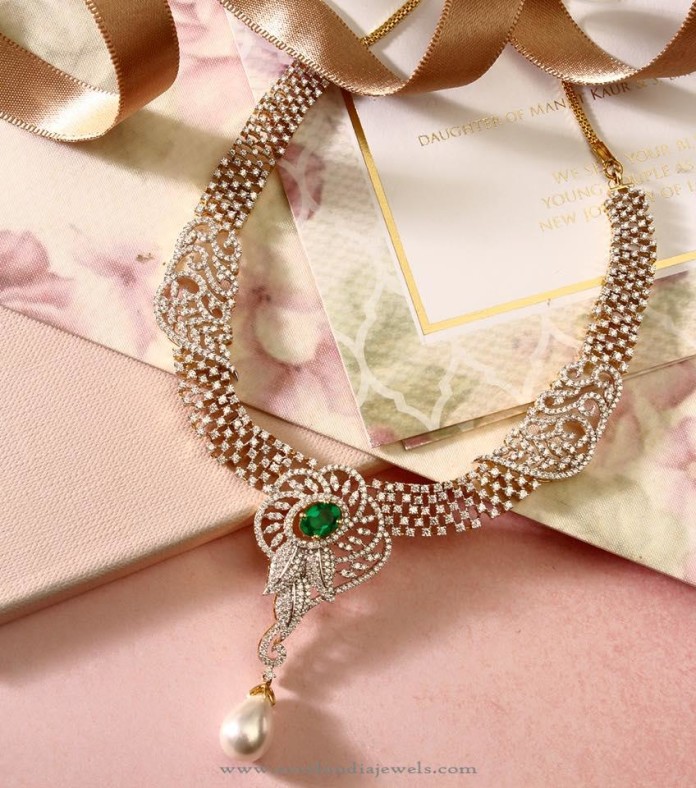
You are a GUI agent. You are given a task and a screenshot of the screen. Output one action in this format:
    pyautogui.click(x=<x>, y=<y>)
    Task: Click on the canvas
    Image resolution: width=696 pixels, height=788 pixels.
    Given the screenshot: What is the action you would take?
    (79, 195)